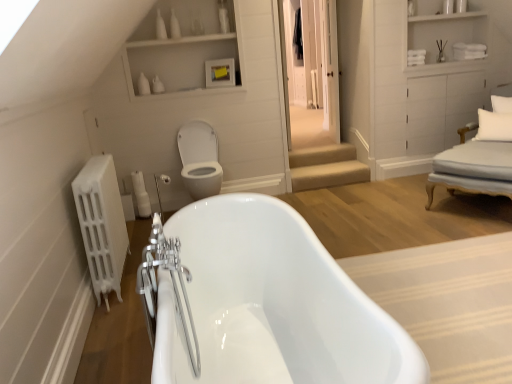
This screenshot has width=512, height=384. Find the location of `transparent glass door at center`. transparent glass door at center is located at coordinates (315, 58).

Identify the location of white glossy bath at center. This screenshot has height=384, width=512. (448, 303).

Image resolution: width=512 pixels, height=384 pixels. What are the coordinates of `white fabric armchair at right` in the screenshot? It's located at (477, 160).

What do you see at coordinates (102, 225) in the screenshot? I see `white matte radiator at left` at bounding box center [102, 225].

Image resolution: width=512 pixels, height=384 pixels. What are the coordinates of `white wood cabinet at upper right` in the screenshot? It's located at (447, 35).

From the image's perspective, between white soft pillow at right, which is counted as the second pillow, starting from the top, and transparent glass door at center, which one is located above?

From the image's view, transparent glass door at center is above.

How far apart are white soft pillow at right, the first pillow positioned from the bottom, and transparent glass door at center?

They are 2.03 meters apart.

Which of these two, white soft pillow at right, the first pillow positioned from the bottom, or transparent glass door at center, is wider?

Wider between the two is white soft pillow at right, the first pillow positioned from the bottom.

Which is behind, point (499, 125) or point (310, 5)?

Positioned behind is point (310, 5).

Looking at this image, is white wood cabinet at upper right a part of white fabric armchair at right?

Definitely not — white wood cabinet at upper right is not inside white fabric armchair at right.

Is there a large distance between white fabric armchair at right and white wood cabinet at upper right?

Yes, white fabric armchair at right and white wood cabinet at upper right are located far from each other.

Does white fabric armchair at right come behind white wood cabinet at upper right?

That is False.

Locate an element on the screen. cabinet on the left of white fabric armchair at right is located at coordinates (447, 35).

Considering the sizes of objects white glossy bath at center and white wood cabinet at upper right in the image provided, who is taller, white glossy bath at center or white wood cabinet at upper right?

With more height is white wood cabinet at upper right.

Does white glossy bath at center touch white wood cabinet at upper right?

No, white glossy bath at center is not making contact with white wood cabinet at upper right.

Would you say white glossy bath at center contains white wood cabinet at upper right?

No, white glossy bath at center does not contain white wood cabinet at upper right.

Is white glossy bath at center in front of or behind white wood cabinet at upper right in the image?

Visually, white glossy bath at center is located in front of white wood cabinet at upper right.

Is white glossy bath at center facing towards white soft pillow at right, which is counted as the second pillow, starting from the top?

No, white glossy bath at center does not turn towards white soft pillow at right, which is counted as the second pillow, starting from the top.

Which of these two, white glossy bath at center or white soft pillow at right, which is counted as the second pillow, starting from the top, stands shorter?

Standing shorter between the two is white glossy bath at center.

From a real-world perspective, is white glossy bath at center positioned above or below white soft pillow at right, which is counted as the second pillow, starting from the top?

Clearly, from a real-world perspective, white glossy bath at center is below white soft pillow at right, which is counted as the second pillow, starting from the top.

The height and width of the screenshot is (384, 512). Find the location of `plain on the left of white soft pillow at right, which is counted as the second pillow, starting from the top`. plain on the left of white soft pillow at right, which is counted as the second pillow, starting from the top is located at coordinates (448, 303).

Are white glossy bathtub at center and white glossy bath at center beside each other?

There is a gap between white glossy bathtub at center and white glossy bath at center.

Is point (290, 283) closer or farther from the camera than point (507, 289)?

Point (290, 283) appears to be closer to the viewer than point (507, 289).

Is white glossy bathtub at center facing towards white glossy bath at center?

No, white glossy bathtub at center is not turned towards white glossy bath at center.

The width and height of the screenshot is (512, 384). What are the coordinates of `plain lying on the right of white glossy bathtub at center` in the screenshot? It's located at (448, 303).

Measure the distance between white matte cabinet at upper center and beige carpeted stairs at center.

white matte cabinet at upper center and beige carpeted stairs at center are 1.56 meters apart.

Is white matte cabinet at upper center further to the viewer compared to beige carpeted stairs at center?

No, white matte cabinet at upper center is closer to the camera.

Does white matte cabinet at upper center turn towards beige carpeted stairs at center?

No, white matte cabinet at upper center is not aimed at beige carpeted stairs at center.

Where is `stairwell below the white matte cabinet at upper center (from the image's perspective)`? stairwell below the white matte cabinet at upper center (from the image's perspective) is located at coordinates (326, 167).

From a real-world perspective, is white fabric pillow at upper right, the 2th pillow when ordered from bottom to top, on top of white glossy toilet bowl at center?

Correct, in the physical world, white fabric pillow at upper right, the 2th pillow when ordered from bottom to top, is higher than white glossy toilet bowl at center.

From the image's perspective, is white fabric pillow at upper right, placed as the 1th pillow when sorted from top to bottom, located above or below white glossy toilet bowl at center?

Clearly, from the image's perspective, white fabric pillow at upper right, placed as the 1th pillow when sorted from top to bottom, is above white glossy toilet bowl at center.

Is white fabric pillow at upper right, the 2th pillow when ordered from bottom to top, to the left of white glossy toilet bowl at center from the viewer's perspective?

No, white fabric pillow at upper right, the 2th pillow when ordered from bottom to top, is not to the left of white glossy toilet bowl at center.

Locate an element on the screen. Image resolution: width=512 pixels, height=384 pixels. the 2nd pillow behind the white glossy toilet bowl at center, counting from the anchor's position is located at coordinates (501, 104).

The image size is (512, 384). Identify the location of glass door that is above the white soft pillow at right, the first pillow positioned from the bottom (from a real-world perspective). point(315,58).

Image resolution: width=512 pixels, height=384 pixels. I want to click on armchair in front of the white wood cabinet at upper right, so click(x=477, y=160).

Looking at the image, which one is located closer to white glossy toilet bowl at center, white glossy bath at center or white matte radiator at left?

The object closer to white glossy toilet bowl at center is white matte radiator at left.

Estimate the real-world distances between objects in this image. Which object is further from white glossy bathtub at center, white glossy toilet bowl at center or white glossy bath at center?

white glossy toilet bowl at center lies further to white glossy bathtub at center than the other object.

Looking at this image, considering their positions, is white fabric armchair at right positioned closer to white soft pillow at right, the first pillow positioned from the bottom, than transparent glass door at center?

white fabric armchair at right.

From the image, which object appears to be nearer to transparent glass door at center, white matte radiator at left or white fabric armchair at right?

Among the two, white fabric armchair at right is located nearer to transparent glass door at center.

From the image, which object appears to be farther from white fabric pillow at upper right, the 2th pillow when ordered from bottom to top, white fabric armchair at right or white soft pillow at right, which is counted as the second pillow, starting from the top?

white fabric armchair at right lies further to white fabric pillow at upper right, the 2th pillow when ordered from bottom to top, than the other object.

Estimate the real-world distances between objects in this image. Which object is closer to white matte cabinet at upper center, white fabric pillow at upper right, the 2th pillow when ordered from bottom to top, or white fabric armchair at right?

The object closer to white matte cabinet at upper center is white fabric armchair at right.

Considering their positions, is white matte radiator at left positioned closer to white fabric pillow at upper right, the 2th pillow when ordered from bottom to top, than white glossy bathtub at center?

Based on the image, white glossy bathtub at center appears to be nearer to white fabric pillow at upper right, the 2th pillow when ordered from bottom to top.

Considering their positions, is white matte radiator at left positioned closer to white wood cabinet at upper right than white fabric armchair at right?

Among the two, white fabric armchair at right is located nearer to white wood cabinet at upper right.

Where is `bathtub located between white matte radiator at left and white glossy bath at center in the left-right direction`? bathtub located between white matte radiator at left and white glossy bath at center in the left-right direction is located at coordinates (272, 304).

Where is `toilet bowl located between white matte radiator at left and white glossy bath at center in the left-right direction`? The height and width of the screenshot is (384, 512). toilet bowl located between white matte radiator at left and white glossy bath at center in the left-right direction is located at coordinates (199, 159).

You are a GUI agent. You are given a task and a screenshot of the screen. Output one action in this format:
    pyautogui.click(x=<x>, y=<y>)
    Task: Click on the toilet bowl between white matte radiator at left and white soft pillow at right, the first pillow positioned from the bottom, from left to right
    
    Given the screenshot: What is the action you would take?
    (x=199, y=159)

This screenshot has height=384, width=512. I want to click on bathtub between white matte cabinet at upper center and white fabric pillow at upper right, the 2th pillow when ordered from bottom to top, in the horizontal direction, so click(x=272, y=304).